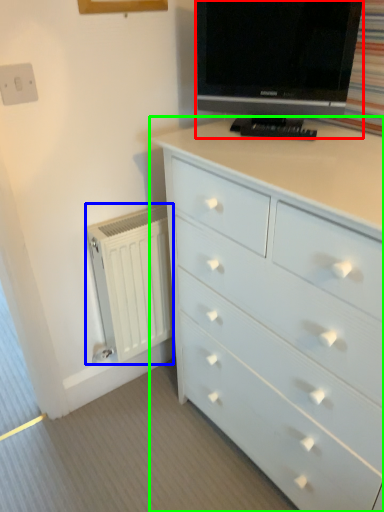
Question: Based on their relative distances, which object is nearer to television (highlighted by a red box)? Choose from radiator (highlighted by a blue box) and chest of drawers (highlighted by a green box).

Choices:
 (A) radiator
 (B) chest of drawers

Answer: (B)